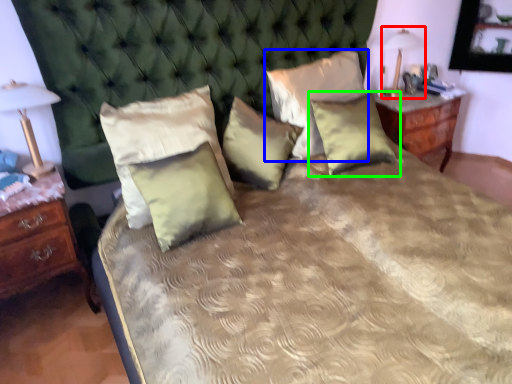
Question: Considering the real-world distances, which object is farthest from bedside lamp (highlighted by a red box)? pillow (highlighted by a blue box) or pillow (highlighted by a green box)?

Choices:
 (A) pillow
 (B) pillow

Answer: (B)